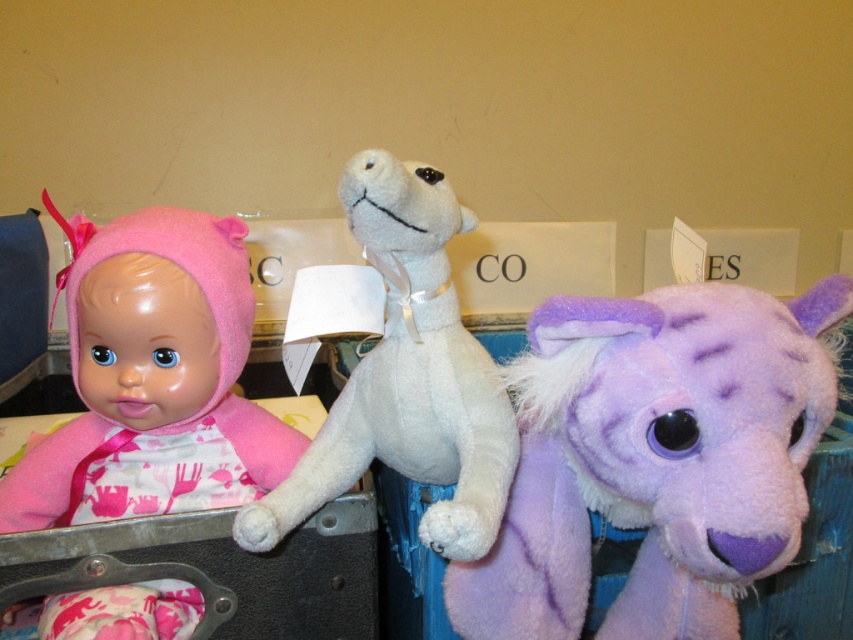
You are a customer at a store and want to pick up the purple plush horse at right. If your hand can reach up to 20 inches, will you be able to reach it?

The purple plush horse at right is 21.41 inches away from the viewer, which is beyond the 20 inches reach of your hand. Therefore, you won

You are a customer at a toy store and want to buy a gift for a baby. You see the matte pink fabric doll at left and the white soft stuffed animal at center. Which one is larger in size?

The matte pink fabric doll at left is bigger than the white soft stuffed animal at center, so the matte pink fabric doll at left is larger in size.